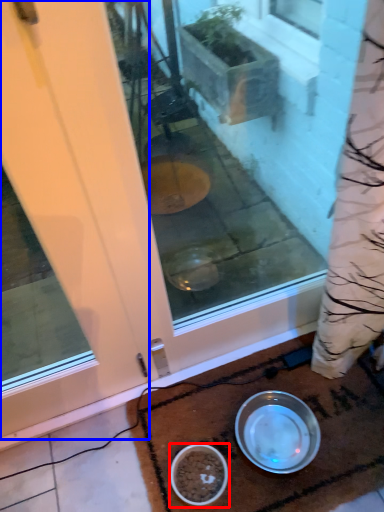
Question: Which object is closer to the camera taking this photo, bowl (highlighted by a red box) or door (highlighted by a blue box)?

Choices:
 (A) bowl
 (B) door

Answer: (B)